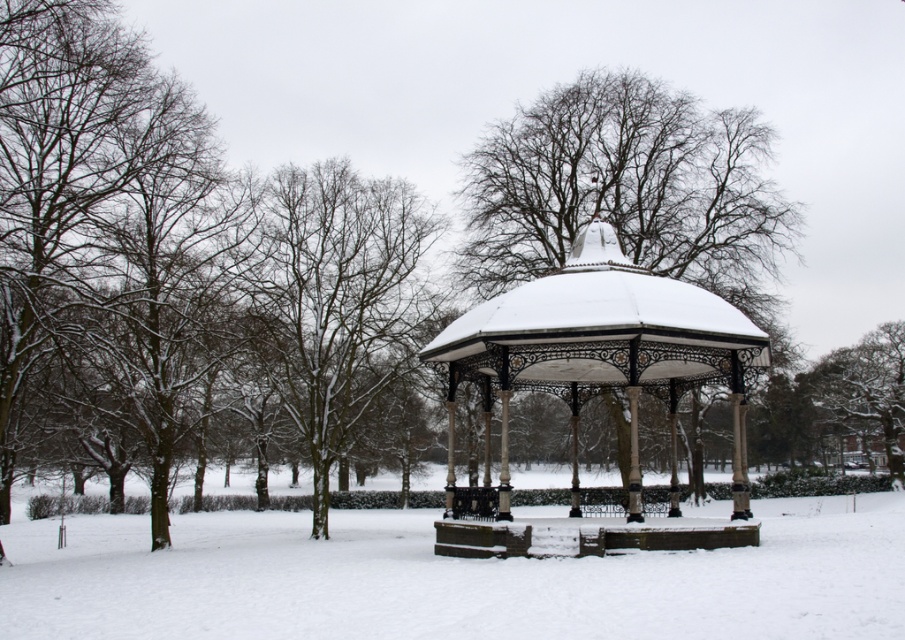
Question: Can you confirm if white powdery snow at center is wider than snow-covered branches at left?

Choices:
 (A) yes
 (B) no

Answer: (A)

Question: Does white powdery snow at center lie behind snow-covered tree at right?

Choices:
 (A) yes
 (B) no

Answer: (B)

Question: Which object appears closest to the camera in this image?

Choices:
 (A) snow-covered tree at right
 (B) snow-covered metal gazebo at center

Answer: (B)

Question: Which point is farther from the camera taking this photo?

Choices:
 (A) (8, 536)
 (B) (808, 392)

Answer: (B)

Question: Can you confirm if snow-covered metal gazebo at center is positioned below snow-covered branches at left?

Choices:
 (A) no
 (B) yes

Answer: (B)

Question: Which of the following is the closest to the observer?

Choices:
 (A) (265, 312)
 (B) (575, 477)
 (C) (894, 369)
 (D) (341, 557)

Answer: (D)